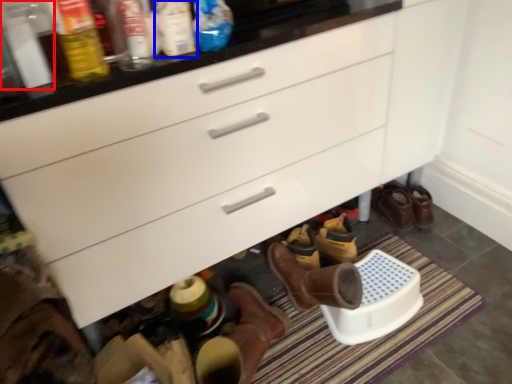
Question: Which point is further to the camera, bottle (highlighted by a red box) or bottle (highlighted by a blue box)?

Choices:
 (A) bottle
 (B) bottle

Answer: (B)